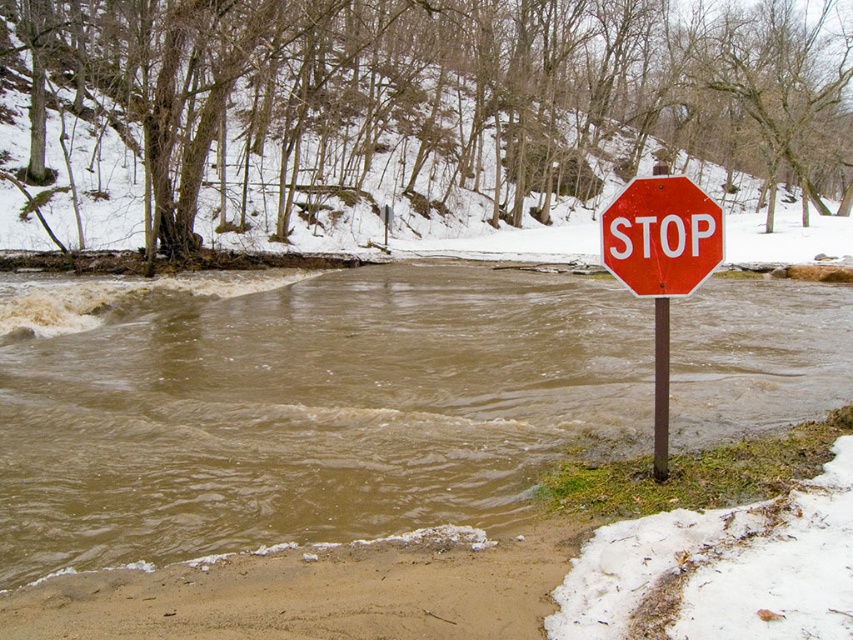
You are a delivery driver who needs to cross the flooded area near the stop sign. The GPS shows the brown muddy water at lower left is at coordinates 0.644, 0.361. Can you safely drive through this area?

The brown muddy water at lower left is located at point (306, 412). Since the water is brown and muddy, it indicates possible debris or unstable ground beneath, which may pose a risk to driving through safely.

You are a hiker trying to cross the area shown in the image. You need to know if the brown muddy water at lower left is wider than the red glossy stop sign at right to plan your path. Can you determine this?

The brown muddy water at lower left might be wider than the red glossy stop sign at right, so it is possible that the water is wider. However, without exact measurements, this cannot be confirmed with certainty.